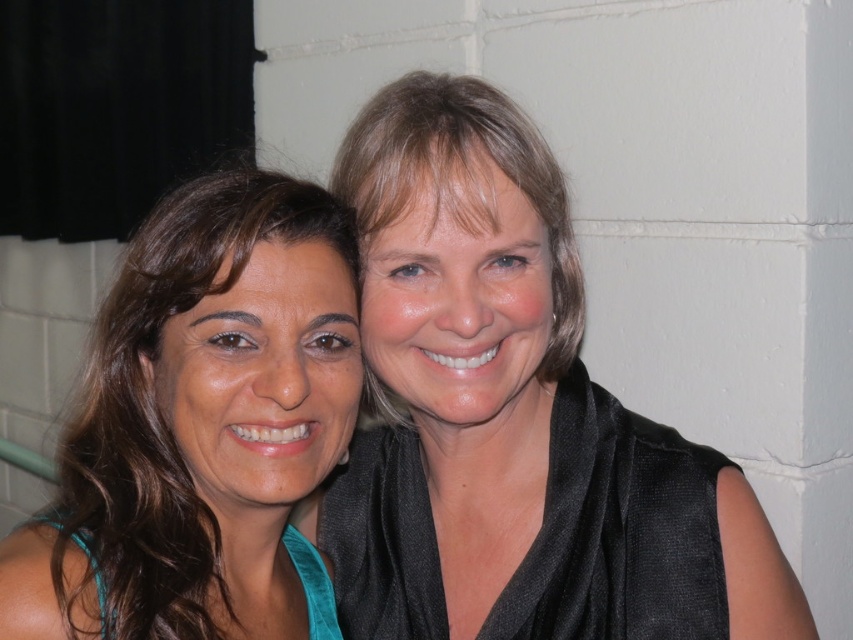
Question: Which point is closer to the camera?

Choices:
 (A) teal fabric top at left
 (B) matte black hair at upper center

Answer: (A)

Question: Can you confirm if teal fabric top at left is positioned above matte black hair at upper center?

Choices:
 (A) no
 (B) yes

Answer: (A)

Question: Based on their relative distances, which object is nearer to the teal fabric top at left?

Choices:
 (A) matte black hair at upper center
 (B) black satin scarf at upper right

Answer: (B)

Question: Which point is farther from the camera taking this photo?

Choices:
 (A) (283, 536)
 (B) (550, 371)
 (C) (413, 461)

Answer: (A)

Question: Is black satin scarf at upper right bigger than matte black hair at upper center?

Choices:
 (A) yes
 (B) no

Answer: (A)

Question: Is black satin scarf at upper right thinner than teal fabric top at left?

Choices:
 (A) yes
 (B) no

Answer: (B)